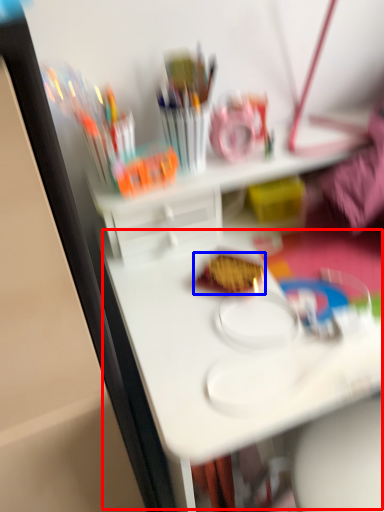
Question: Which point is further to the camera, table (highlighted by a red box) or food (highlighted by a blue box)?

Choices:
 (A) table
 (B) food

Answer: (B)